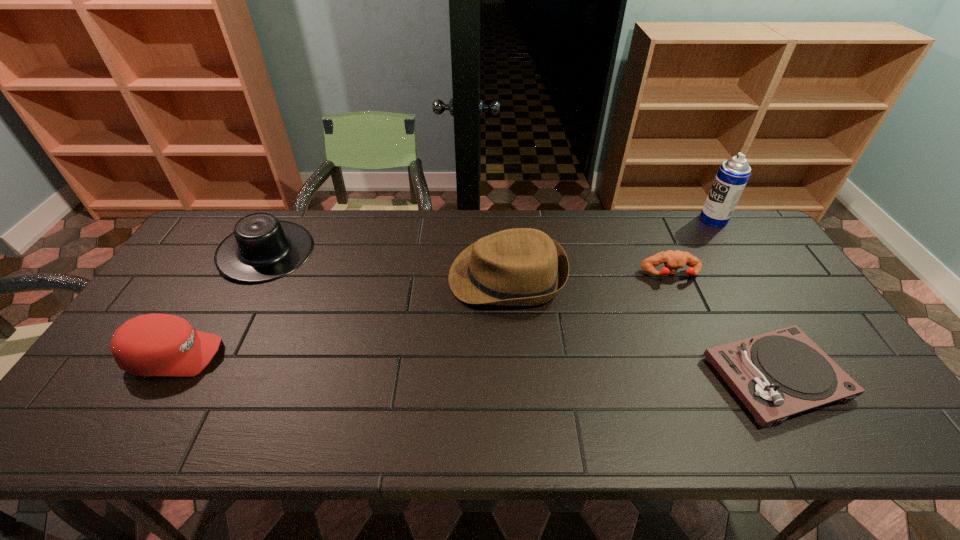
This screenshot has height=540, width=960. I want to click on blank area located on the front-facing side of the fedora, so click(x=322, y=277).

Where is `vacant space located 0.070m on the front-facing side of the fedora`? The image size is (960, 540). vacant space located 0.070m on the front-facing side of the fedora is located at coordinates (425, 277).

Locate an element on the screen. Image resolution: width=960 pixels, height=540 pixels. vacant space located 0.240m on the right of the dress hat is located at coordinates (387, 252).

You are a GUI agent. You are given a task and a screenshot of the screen. Output one action in this format:
    pyautogui.click(x=<x>, y=<y>)
    Task: Click on the free location located 0.210m on the front-facing side of the cap
    The width and height of the screenshot is (960, 540).
    Given the screenshot: What is the action you would take?
    pyautogui.click(x=305, y=355)

Locate an element on the screen. This screenshot has width=960, height=540. vacant space located with the gloves of the puncher facing forward is located at coordinates (702, 343).

Where is `free space located on the left of the phonograph_record`? The width and height of the screenshot is (960, 540). free space located on the left of the phonograph_record is located at coordinates (628, 377).

Where is `aerosol can positioned at the far edge`? aerosol can positioned at the far edge is located at coordinates (733, 174).

The height and width of the screenshot is (540, 960). What are the coordinates of `fedora positioned at the far edge` in the screenshot? It's located at (515, 267).

Identify the location of dress hat at the far edge. [x=262, y=248].

Identify the location of object that is at the near edge. (777, 374).